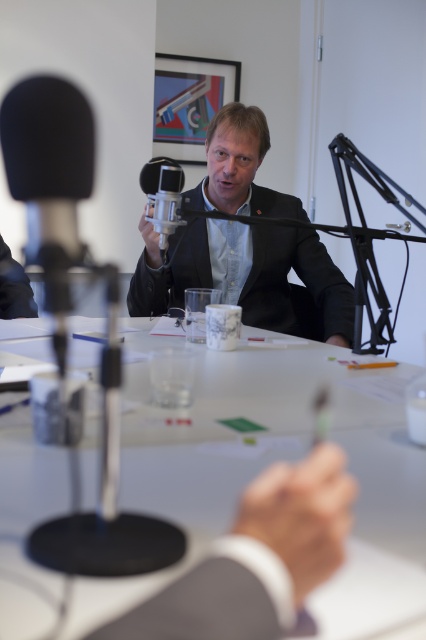
Who is positioned more to the right, white glossy table at center or satin black microphone at center?

white glossy table at center

Who is lower down, white glossy table at center or satin black microphone at center?

Positioned lower is white glossy table at center.

The height and width of the screenshot is (640, 426). What do you see at coordinates (287, 460) in the screenshot?
I see `white glossy table at center` at bounding box center [287, 460].

Where is `white glossy table at center`? Image resolution: width=426 pixels, height=640 pixels. white glossy table at center is located at coordinates (287, 460).

Is point (386, 385) positioned behind point (141, 260)?

That is False.

Between point (149, 435) and point (253, 260), which one is positioned in front?

Point (149, 435) is in front.

Where is `white glossy table at center`? This screenshot has height=640, width=426. white glossy table at center is located at coordinates (287, 460).

Is matte black suit at center to the left of satin black microphone at center from the viewer's perspective?

In fact, matte black suit at center is to the right of satin black microphone at center.

Can you confirm if matte black suit at center is taller than satin black microphone at center?

Yes.

Is point (195, 227) farther from camera compared to point (169, 179)?

Yes, it is.

Where is `matte black suit at center`? The height and width of the screenshot is (640, 426). matte black suit at center is located at coordinates (245, 275).